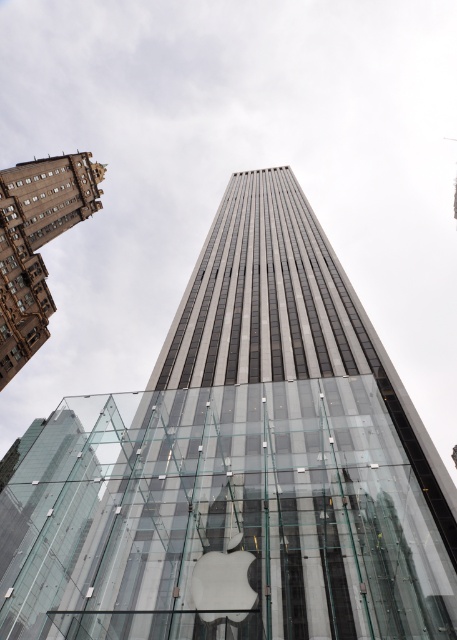
Question: Which object appears farthest from the camera in this image?

Choices:
 (A) brown stone building at upper left
 (B) glassy steel tower at center

Answer: (A)

Question: Does glassy steel tower at center lie in front of brown stone building at upper left?

Choices:
 (A) yes
 (B) no

Answer: (A)

Question: Is glassy steel tower at center below brown stone building at upper left?

Choices:
 (A) yes
 (B) no

Answer: (A)

Question: Is glassy steel tower at center in front of brown stone building at upper left?

Choices:
 (A) no
 (B) yes

Answer: (B)

Question: Which point is closer to the camera?

Choices:
 (A) (12, 262)
 (B) (95, 577)

Answer: (B)